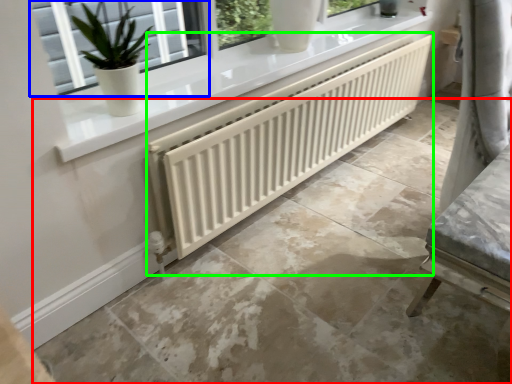
Question: Based on their relative distances, which object is nearer to concrete (highlighted by a red box)? Choose from window (highlighted by a blue box) and radiator (highlighted by a green box).

Choices:
 (A) window
 (B) radiator

Answer: (B)